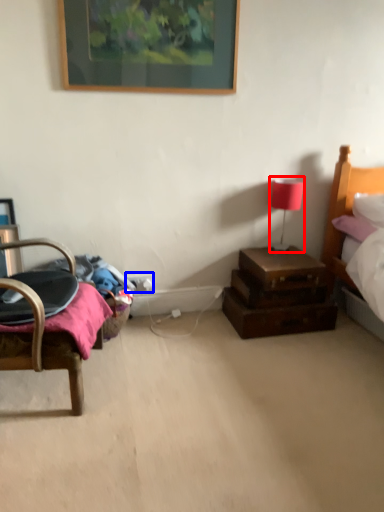
Question: Which object appears farthest to the camera in this image, table lamp (highlighted by a red box) or electric outlet (highlighted by a blue box)?

Choices:
 (A) table lamp
 (B) electric outlet

Answer: (B)